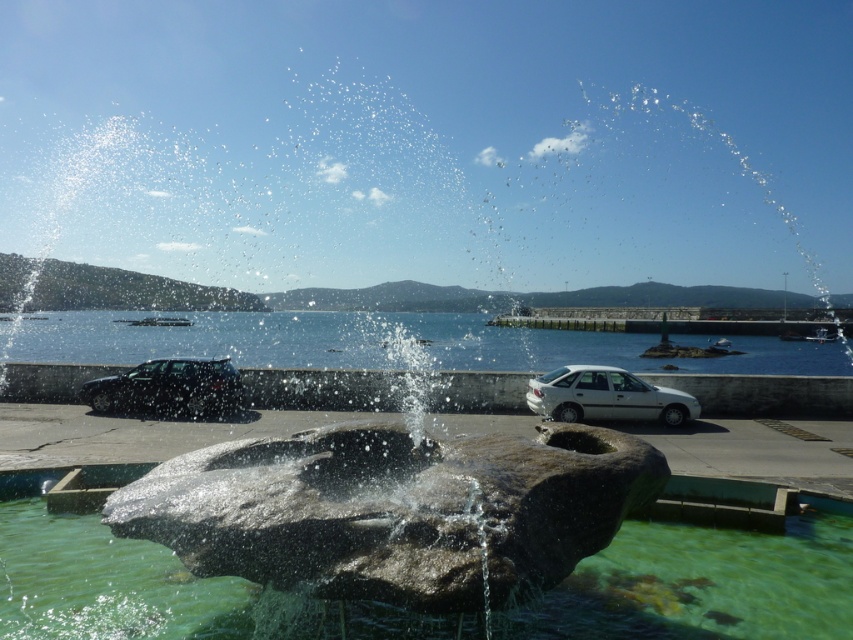
Question: Is metallic gray car at left positioned before silver metallic car at center?

Choices:
 (A) no
 (B) yes

Answer: (A)

Question: Which is farther from the silver metallic car at center?

Choices:
 (A) metallic gray car at left
 (B) clear stone water at center

Answer: (A)

Question: Among these points, which one is nearest to the camera?

Choices:
 (A) (614, 403)
 (B) (146, 410)
 (C) (796, 579)
 (D) (640, 440)

Answer: (D)

Question: From the image, what is the correct spatial relationship of rough stone fountain at center in relation to clear stone water at center?

Choices:
 (A) below
 (B) above

Answer: (B)

Question: Is rough stone fountain at center further to camera compared to silver metallic car at center?

Choices:
 (A) no
 (B) yes

Answer: (A)

Question: Which object appears farthest from the camera in this image?

Choices:
 (A) metallic gray car at left
 (B) rough stone fountain at center

Answer: (A)